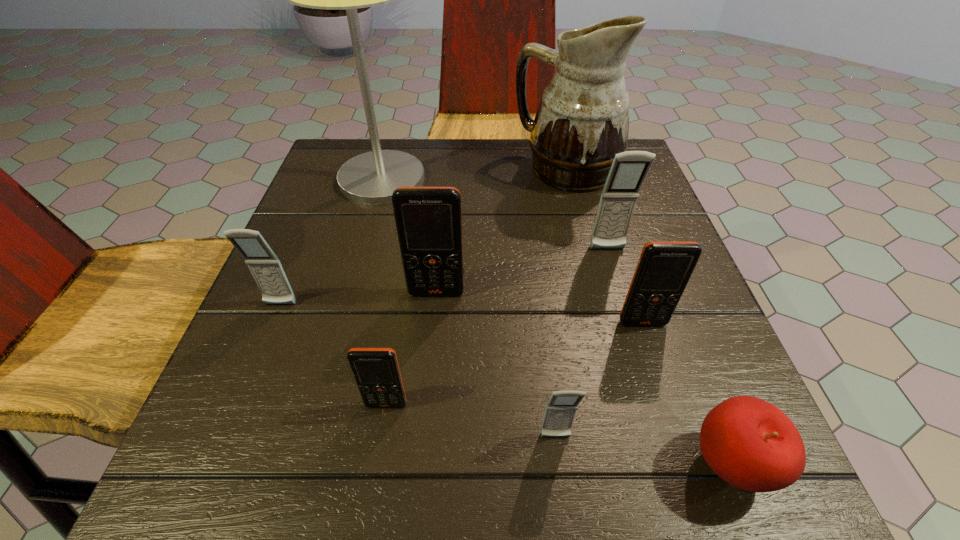
Identify the location of free spot between the third nearest object and the second tallest object. (476, 287).

You are a GUI agent. You are given a task and a screenshot of the screen. Output one action in this format:
    pyautogui.click(x=<x>, y=<y>)
    Task: Click on the unoccupied area between the second nearest cellular telephone and the third farthest cellular telephone
    This screenshot has width=960, height=540.
    Given the screenshot: What is the action you would take?
    pyautogui.click(x=333, y=355)

Where is `object that is the closest to the rightmost orange cellular telephone`? The height and width of the screenshot is (540, 960). object that is the closest to the rightmost orange cellular telephone is located at coordinates pyautogui.click(x=629, y=169).

In order to click on object that stands as the sixth closest to the nearest gray cellular telephone in this screenshot , I will do `click(264, 265)`.

Select which cellular telephone is the closest to the apple. Please provide its 2D coordinates. Your answer should be formatted as a tuple, i.e. [(x, y)], where the tuple contains the x and y coordinates of a point satisfying the conditions above.

[(560, 411)]

Choose which cellular telephone is the third nearest neighbor to the smallest orange cellular telephone. Please provide its 2D coordinates. Your answer should be formatted as a tuple, i.e. [(x, y)], where the tuple contains the x and y coordinates of a point satisfying the conditions above.

[(264, 265)]

Locate which gray cellular telephone is the closest to the fifth nearest cellular telephone. Please provide its 2D coordinates. Your answer should be formatted as a tuple, i.e. [(x, y)], where the tuple contains the x and y coordinates of a point satisfying the conditions above.

[(264, 265)]

The height and width of the screenshot is (540, 960). I want to click on gray cellular telephone that is the third closest to the table lamp, so click(560, 411).

Locate an element on the screen. The width and height of the screenshot is (960, 540). orange cellular telephone that is the second closest to the biggest orange cellular telephone is located at coordinates (664, 268).

Identify which orange cellular telephone is the second nearest to the third cellular telephone from right to left. Please provide its 2D coordinates. Your answer should be formatted as a tuple, i.e. [(x, y)], where the tuple contains the x and y coordinates of a point satisfying the conditions above.

[(664, 268)]